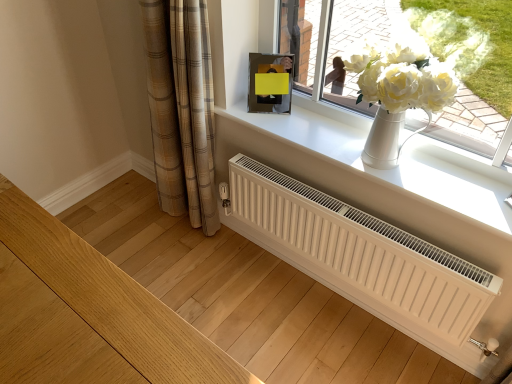
Question: Can you confirm if plaid fabric curtain at lower left is taller than white matte radiator at center?

Choices:
 (A) no
 (B) yes

Answer: (B)

Question: Is plaid fabric curtain at lower left to the left of white matte radiator at center from the viewer's perspective?

Choices:
 (A) yes
 (B) no

Answer: (A)

Question: Does plaid fabric curtain at lower left appear on the right side of white matte radiator at center?

Choices:
 (A) yes
 (B) no

Answer: (B)

Question: Considering the relative sizes of plaid fabric curtain at lower left and white matte radiator at center in the image provided, is plaid fabric curtain at lower left shorter than white matte radiator at center?

Choices:
 (A) yes
 (B) no

Answer: (B)

Question: Is plaid fabric curtain at lower left oriented towards white matte radiator at center?

Choices:
 (A) no
 (B) yes

Answer: (A)

Question: From their relative heights in the image, would you say white matte radiator at center is taller or shorter than white smooth window sill at upper center?

Choices:
 (A) tall
 (B) short

Answer: (A)

Question: Is white matte radiator at center inside the boundaries of white smooth window sill at upper center, or outside?

Choices:
 (A) inside
 (B) outside

Answer: (B)

Question: In the image, is white matte radiator at center positioned in front of or behind white smooth window sill at upper center?

Choices:
 (A) behind
 (B) front

Answer: (B)

Question: Visually, is white matte radiator at center positioned to the left or to the right of white smooth window sill at upper center?

Choices:
 (A) right
 (B) left

Answer: (B)

Question: Looking at their shapes, would you say white ceramic vase at upper center is wider or thinner than plaid fabric curtain at lower left?

Choices:
 (A) wide
 (B) thin

Answer: (B)

Question: Which is correct: white ceramic vase at upper center is inside plaid fabric curtain at lower left, or outside of it?

Choices:
 (A) inside
 (B) outside

Answer: (B)

Question: Visually, is white ceramic vase at upper center positioned to the left or to the right of plaid fabric curtain at lower left?

Choices:
 (A) left
 (B) right

Answer: (B)

Question: Is white ceramic vase at upper center in front of or behind plaid fabric curtain at lower left in the image?

Choices:
 (A) behind
 (B) front

Answer: (B)

Question: From a real-world perspective, is metallic reflective picture frame at upper center physically located above or below white smooth window sill at upper center?

Choices:
 (A) below
 (B) above

Answer: (B)

Question: In the image, is metallic reflective picture frame at upper center positioned in front of or behind white smooth window sill at upper center?

Choices:
 (A) behind
 (B) front

Answer: (A)